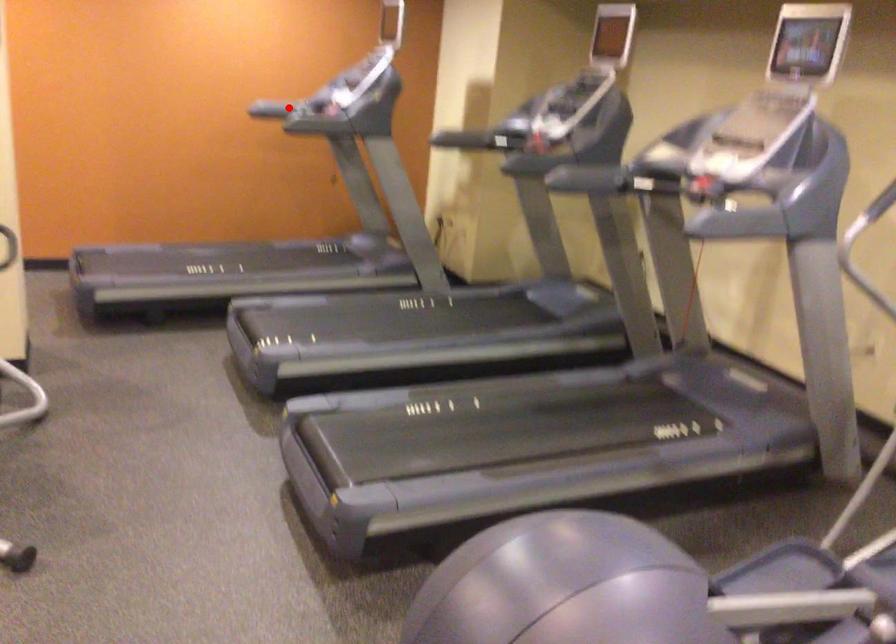
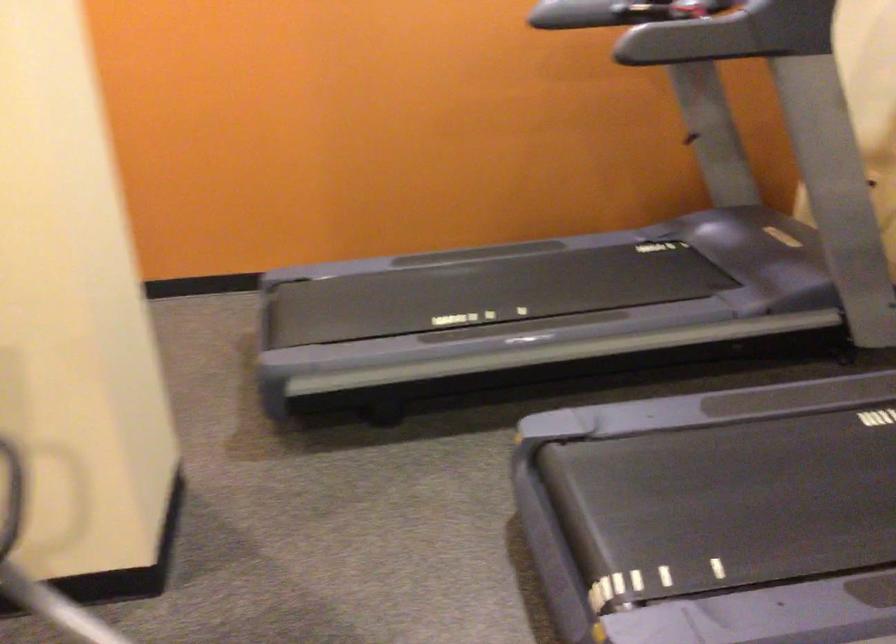
Find the pixel in the second image that matches the highlighted location in the first image.

(572, 15)